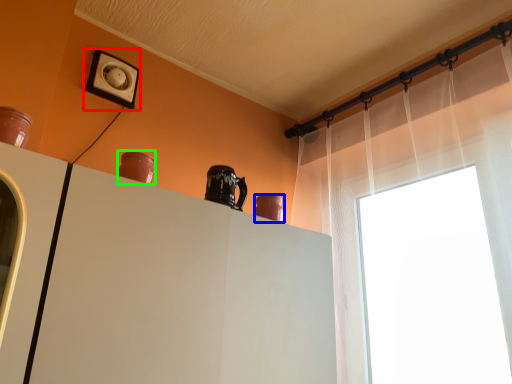
Question: Considering the real-world distances, which object is farthest from electric outlet (highlighted by a red box)? vase (highlighted by a blue box) or vase (highlighted by a green box)?

Choices:
 (A) vase
 (B) vase

Answer: (A)